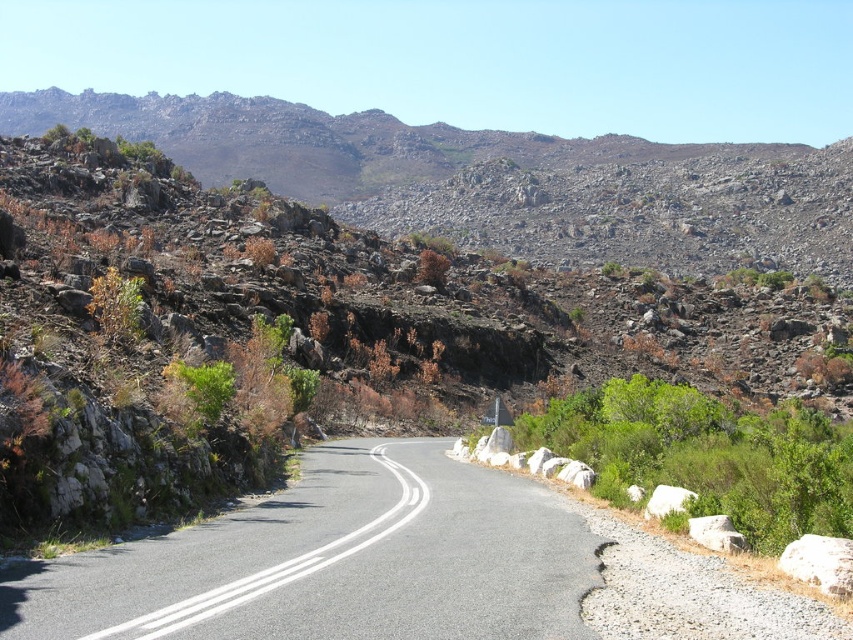
Does white rock at lower right appear under gray rough rock at right?

No.

Who is more forward, (833, 577) or (735, 531)?

Point (833, 577) is more forward.

At what (x,y) coordinates should I click in order to perform the action: click on white rock at lower right. Please return your answer as a coordinate pair (x, y). This screenshot has width=853, height=640. Looking at the image, I should click on (820, 563).

Which is behind, point (486, 179) or point (846, 588)?

Positioned behind is point (486, 179).

Is rugged rock mountain at upper center to the left of white rock at lower right from the viewer's perspective?

Correct, you'll find rugged rock mountain at upper center to the left of white rock at lower right.

Who is more distant from viewer, (694, 244) or (843, 540)?

Point (694, 244)

Find the location of `rugged rock mountain at upper center`. rugged rock mountain at upper center is located at coordinates (498, 179).

Can you confirm if rugged rock mountain at upper center is positioned above asphalt road at center?

Correct, rugged rock mountain at upper center is located above asphalt road at center.

This screenshot has height=640, width=853. Find the location of `rugged rock mountain at upper center`. rugged rock mountain at upper center is located at coordinates (498, 179).

What do you see at coordinates (498, 179) in the screenshot? This screenshot has height=640, width=853. I see `rugged rock mountain at upper center` at bounding box center [498, 179].

Identify the location of rugged rock mountain at upper center. The height and width of the screenshot is (640, 853). (498, 179).